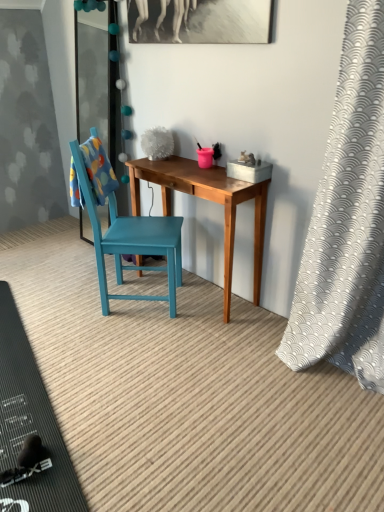
The width and height of the screenshot is (384, 512). Find the location of `vacant space in front of white textured curtain at right`. vacant space in front of white textured curtain at right is located at coordinates (330, 439).